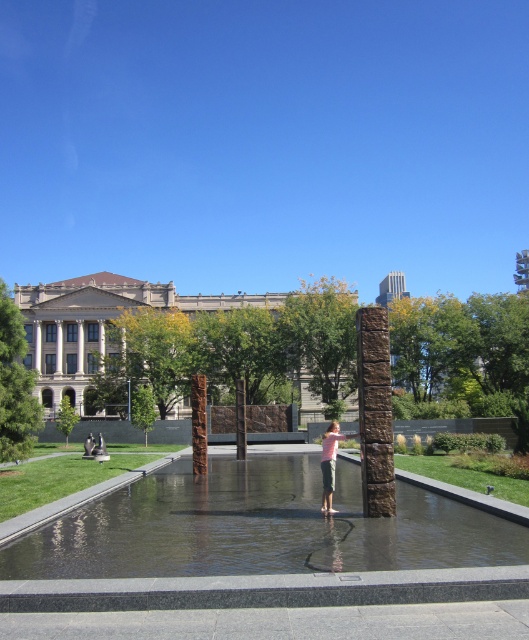
Which is behind, point (281, 572) or point (339, 433)?

Point (339, 433)

Can you confirm if clear glass water at center is positioned above pink cotton shirt at center?

Correct, clear glass water at center is located above pink cotton shirt at center.

Between point (340, 529) and point (332, 436), which one is positioned behind?

Point (332, 436)

Identify the location of clear glass water at center. The height and width of the screenshot is (640, 529). (258, 528).